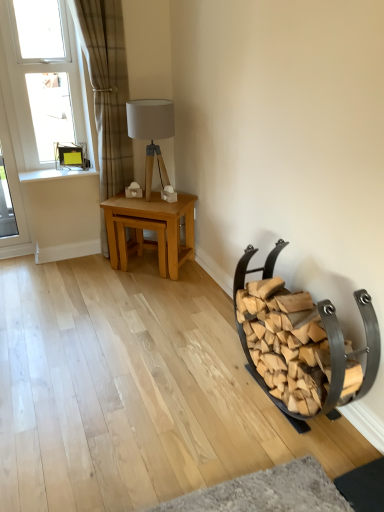
Question: Based on their sizes in the image, would you say wooden firewood rack at lower right is bigger or smaller than white wood at upper left?

Choices:
 (A) small
 (B) big

Answer: (B)

Question: In terms of height, does wooden firewood rack at lower right look taller or shorter compared to white wood at upper left?

Choices:
 (A) tall
 (B) short

Answer: (A)

Question: Which is nearer to the plaid fabric curtain at left?

Choices:
 (A) wooden firewood rack at lower right
 (B) white wood at upper left
 (C) white plastic window at upper left
 (D) light oak table at center
 (E) matte wood table lamp at center

Answer: (C)

Question: Which object is positioned closest to the plaid fabric curtain at left?

Choices:
 (A) matte wood table lamp at center
 (B) light oak table at center
 (C) white wood at upper left
 (D) wooden firewood rack at lower right
 (E) white plastic window at upper left

Answer: (E)